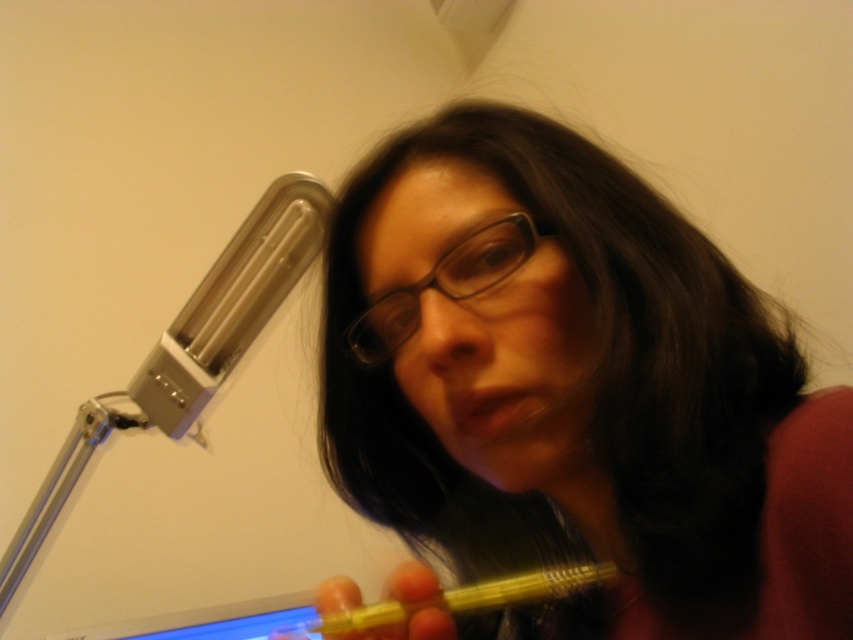
You are a photographer adjusting the focus of your camera. You want to capture a clear image of the translucent yellow pen at center. Given that the pen and viewer are 28.81 centimeters apart, what is the minimum distance you should set your camera lens to ensure sharp focus?

The minimum distance to set the camera lens for sharp focus should be at least 28.81 centimeters, as the translucent yellow pen at center is positioned exactly that distance away from the viewer.

Based on the photo, you are a graphic designer working on a project and need to know the exact location of the translucent yellow pen at center in the image. Can you tell me its coordinates?

The translucent yellow pen at center is located at coordinates point (573,394).